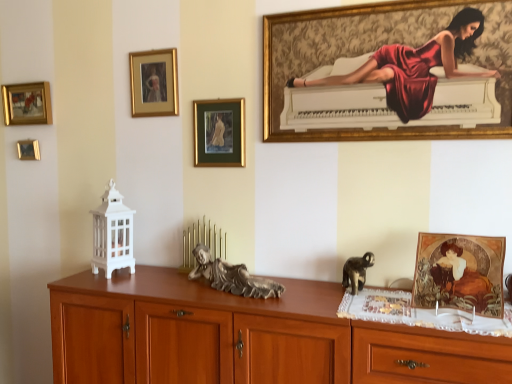
Where is `vacant space in front of shiny metallic cat at lower right, marked as the 2th animal in a left-to-right arrangement`? This screenshot has width=512, height=384. vacant space in front of shiny metallic cat at lower right, marked as the 2th animal in a left-to-right arrangement is located at coordinates (372, 306).